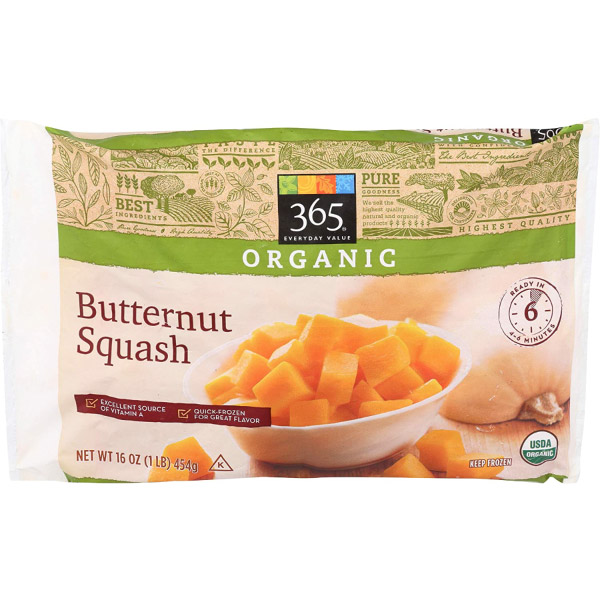
Find the location of `table`. table is located at coordinates (502, 437).